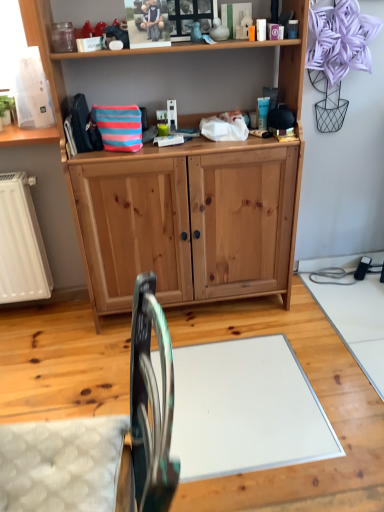
Question: Is natural wood cabinet at center behind metallic teal swivel chair at lower left?

Choices:
 (A) yes
 (B) no

Answer: (A)

Question: Is natural wood cabinet at center oriented away from metallic teal swivel chair at lower left?

Choices:
 (A) no
 (B) yes

Answer: (A)

Question: From a real-world perspective, is natural wood cabinet at center on metallic teal swivel chair at lower left?

Choices:
 (A) no
 (B) yes

Answer: (B)

Question: Can you confirm if natural wood cabinet at center is bigger than metallic teal swivel chair at lower left?

Choices:
 (A) no
 (B) yes

Answer: (B)

Question: Does natural wood cabinet at center appear on the right side of metallic teal swivel chair at lower left?

Choices:
 (A) yes
 (B) no

Answer: (A)

Question: Is natural wood cabinet at center in front of metallic teal swivel chair at lower left?

Choices:
 (A) no
 (B) yes

Answer: (A)

Question: Is metallic teal swivel chair at lower left wider than natural wood cabinet at center?

Choices:
 (A) yes
 (B) no

Answer: (A)

Question: Does metallic teal swivel chair at lower left come behind natural wood cabinet at center?

Choices:
 (A) no
 (B) yes

Answer: (A)

Question: From a real-world perspective, is metallic teal swivel chair at lower left positioned over natural wood cabinet at center based on gravity?

Choices:
 (A) no
 (B) yes

Answer: (A)

Question: Considering the relative sizes of metallic teal swivel chair at lower left and natural wood cabinet at center in the image provided, is metallic teal swivel chair at lower left thinner than natural wood cabinet at center?

Choices:
 (A) yes
 (B) no

Answer: (B)

Question: Is metallic teal swivel chair at lower left shorter than natural wood cabinet at center?

Choices:
 (A) no
 (B) yes

Answer: (B)

Question: Can you confirm if metallic teal swivel chair at lower left is smaller than natural wood cabinet at center?

Choices:
 (A) yes
 (B) no

Answer: (A)

Question: Considering their positions, is natural wood cabinet at center located in front of or behind metallic teal swivel chair at lower left?

Choices:
 (A) behind
 (B) front

Answer: (A)